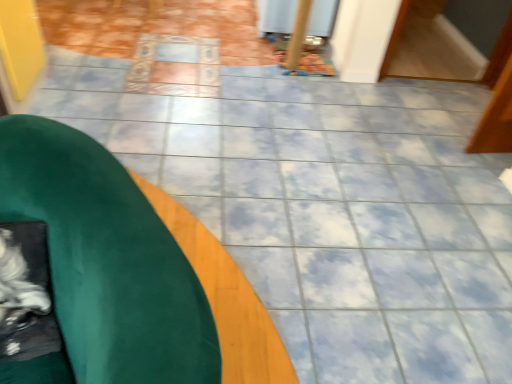
Image resolution: width=512 pixels, height=384 pixels. Identify the location of velvet green cushion at lower left. (133, 269).

Describe the element at coordinates (133, 269) in the screenshot. I see `velvet green cushion at lower left` at that location.

Identify the location of velvet green cushion at lower left. (133, 269).